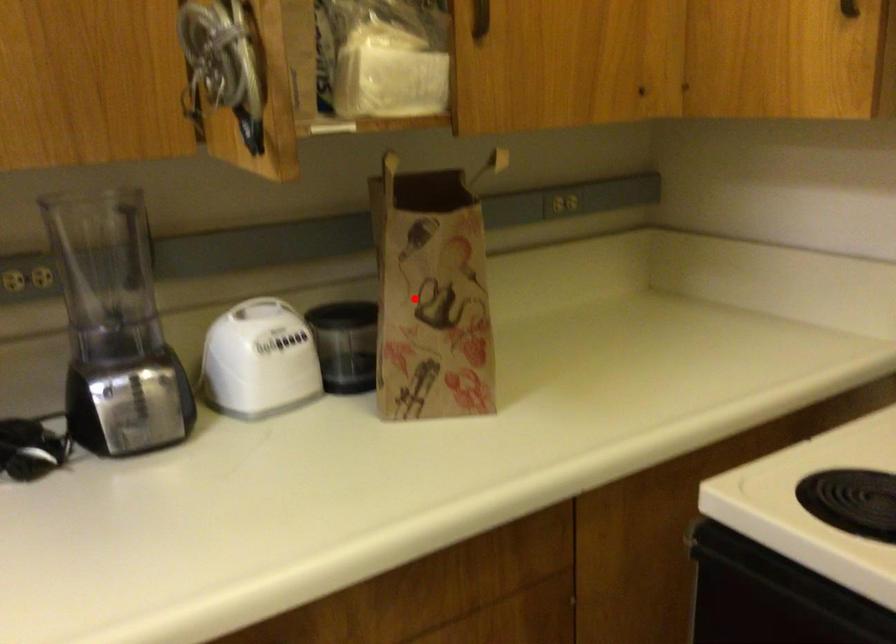
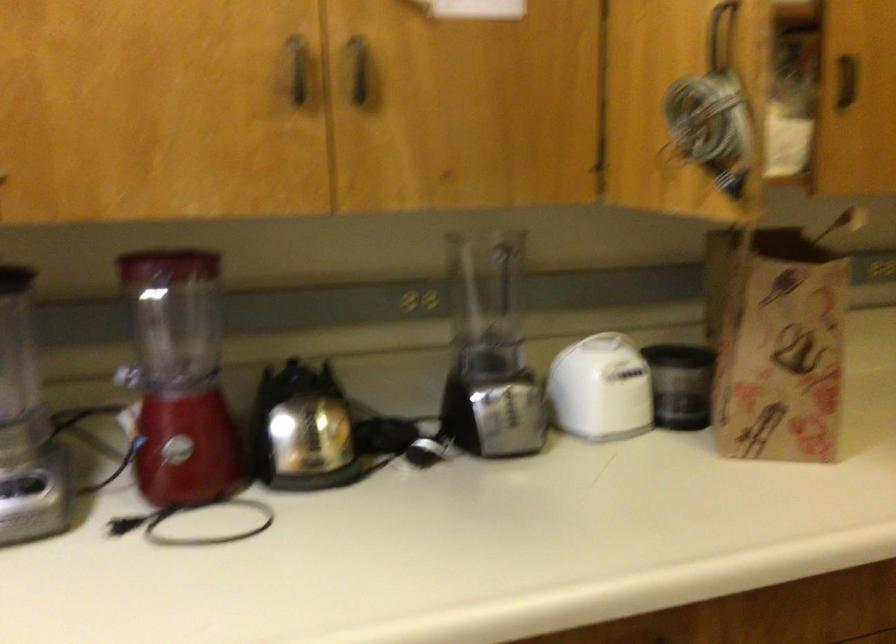
Where in the second image is the point corresponding to the highlighted location from the first image?

(777, 341)